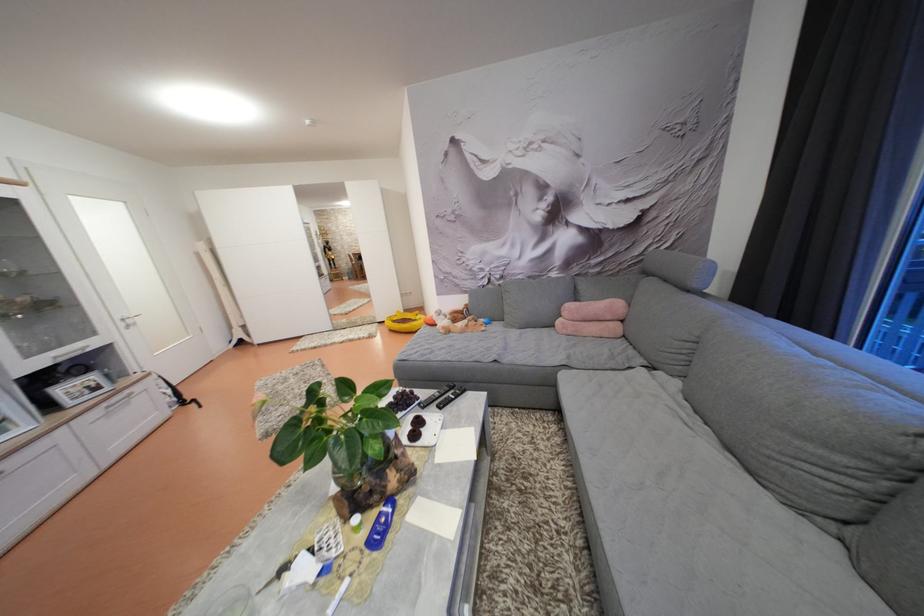
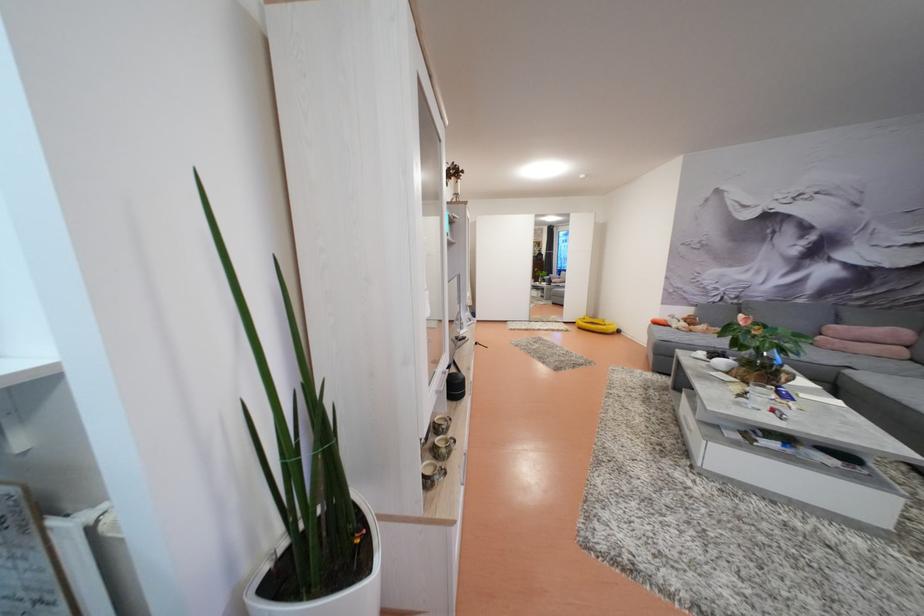
Locate, in the second image, the point that corresponds to the point at 578,310 in the first image.

(841, 333)